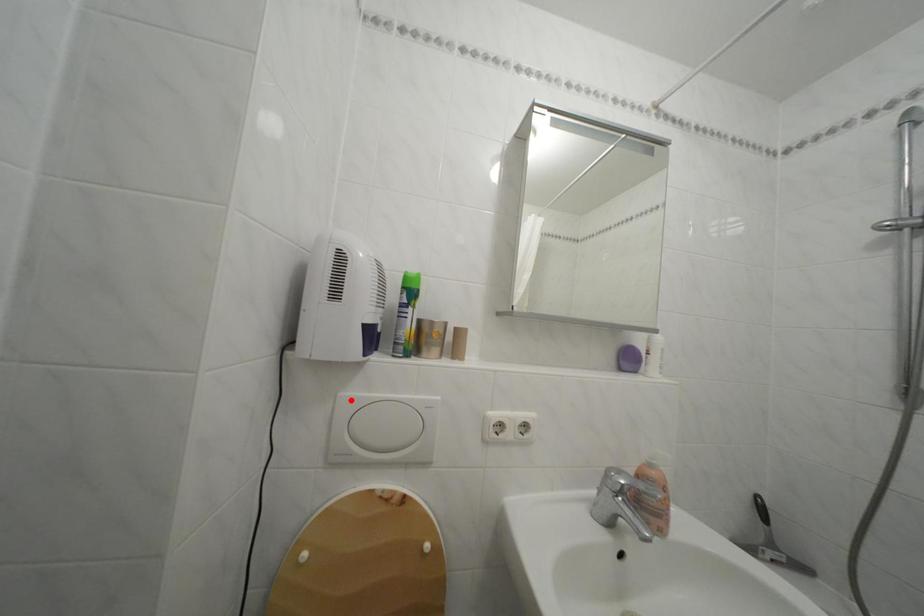
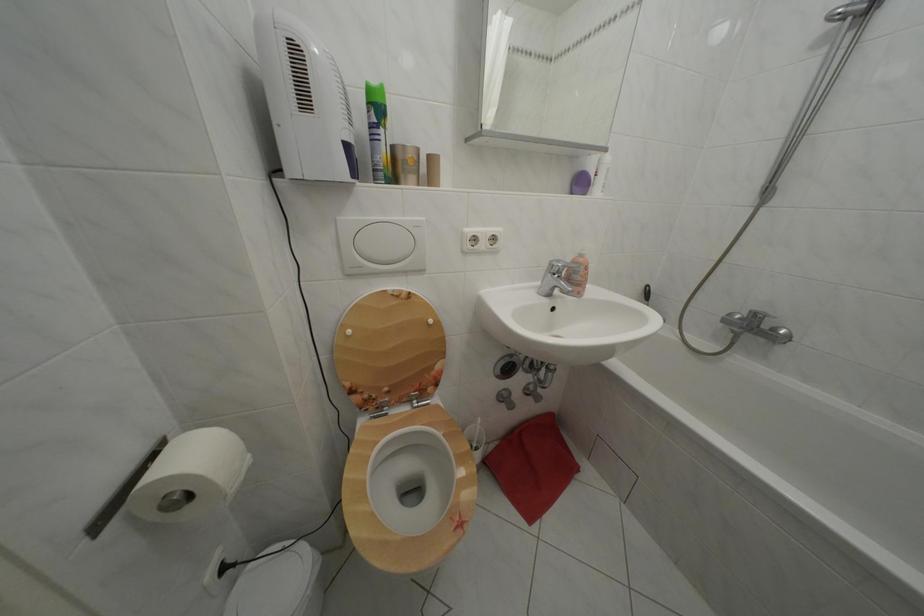
Locate, in the second image, the point that corresponds to the highlighted location in the first image.

(348, 225)